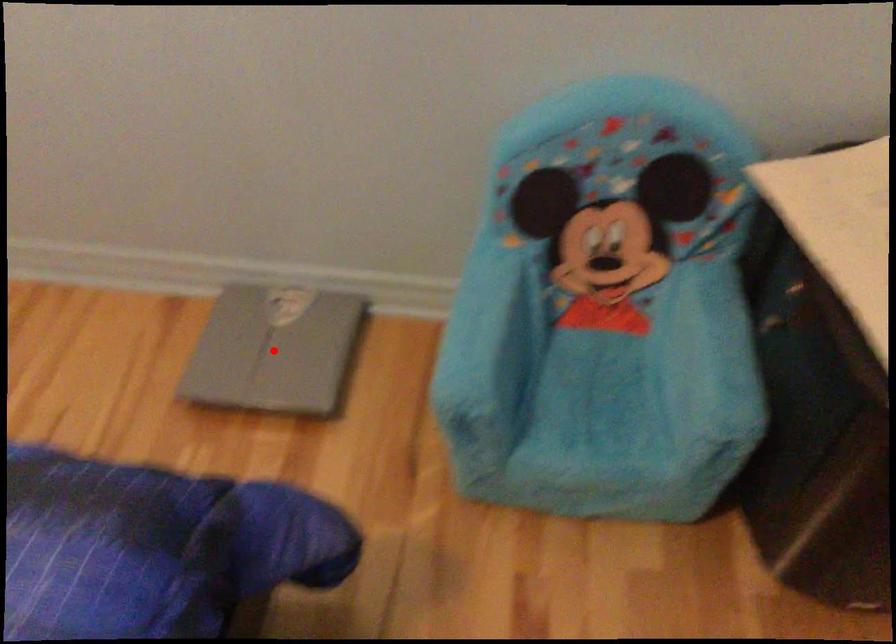
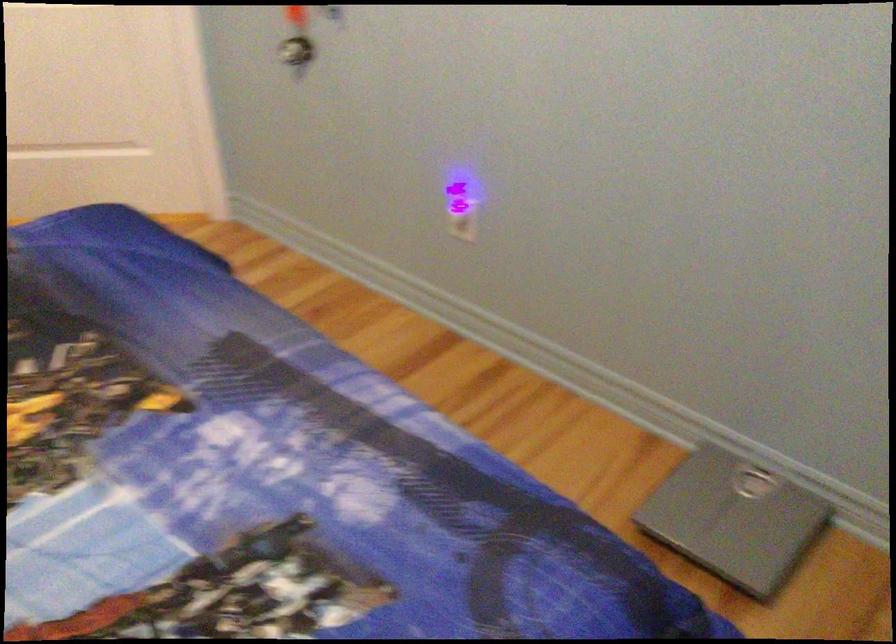
In the second image, find the point that corresponds to the highlighted location in the first image.

(735, 520)